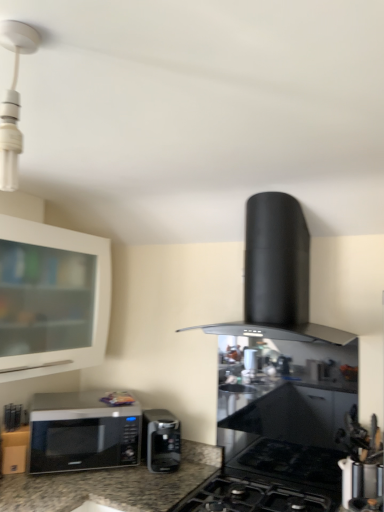
Question: Considering the relative sizes of black matte gas stove at center and metallic silver utensil holder at lower right in the image provided, is black matte gas stove at center thinner than metallic silver utensil holder at lower right?

Choices:
 (A) yes
 (B) no

Answer: (B)

Question: Is black matte gas stove at center at the right side of metallic silver utensil holder at lower right?

Choices:
 (A) no
 (B) yes

Answer: (A)

Question: Considering the relative sizes of black matte gas stove at center and metallic silver utensil holder at lower right in the image provided, is black matte gas stove at center shorter than metallic silver utensil holder at lower right?

Choices:
 (A) yes
 (B) no

Answer: (A)

Question: Is black matte gas stove at center taller than metallic silver utensil holder at lower right?

Choices:
 (A) no
 (B) yes

Answer: (A)

Question: Is the depth of black matte gas stove at center greater than that of metallic silver utensil holder at lower right?

Choices:
 (A) yes
 (B) no

Answer: (B)

Question: From a real-world perspective, is black matte gas stove at center located higher than metallic silver utensil holder at lower right?

Choices:
 (A) no
 (B) yes

Answer: (A)

Question: Is sleek black microwave at lower left, which is counted as the 2th microwave oven, starting from the right, to the right of black matte range hood at center from the viewer's perspective?

Choices:
 (A) yes
 (B) no

Answer: (B)

Question: Is sleek black microwave at lower left, the 1th microwave oven viewed from the left, directly adjacent to black matte range hood at center?

Choices:
 (A) yes
 (B) no

Answer: (B)

Question: Considering the relative sizes of sleek black microwave at lower left, the 1th microwave oven viewed from the left, and black matte range hood at center in the image provided, is sleek black microwave at lower left, the 1th microwave oven viewed from the left, bigger than black matte range hood at center?

Choices:
 (A) yes
 (B) no

Answer: (B)

Question: Does sleek black microwave at lower left, the 1th microwave oven viewed from the left, have a greater width compared to black matte range hood at center?

Choices:
 (A) yes
 (B) no

Answer: (B)

Question: Is sleek black microwave at lower left, the 1th microwave oven viewed from the left, closer to the viewer compared to black matte range hood at center?

Choices:
 (A) yes
 (B) no

Answer: (B)

Question: Is sleek black microwave at lower left, the 1th microwave oven viewed from the left, taller than black matte range hood at center?

Choices:
 (A) yes
 (B) no

Answer: (B)

Question: Could you tell me if metallic silver utensil holder at lower right is facing black matte gas stove at center?

Choices:
 (A) yes
 (B) no

Answer: (B)